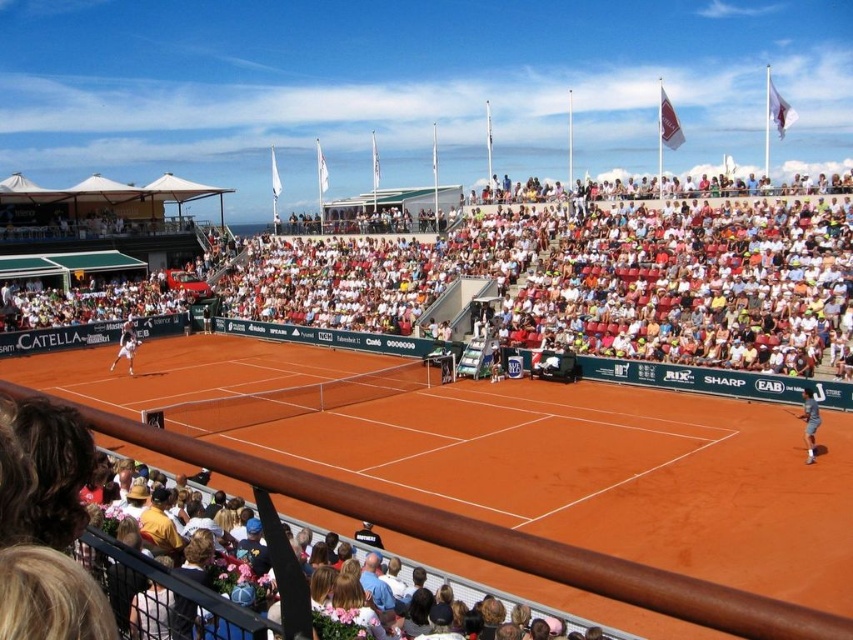
You are a tennis ball that just landed on the orange clay court at center. From your current position, where is the white tennis racket at left located relative to you?

The white tennis racket at left is located below the orange clay court at center.

You are a photographer standing at the edge of the clay court. You want to take a photo that includes both the white fabric seats at upper center and the white tennis racket at left. Which object should you focus on first to ensure both are in frame?

You should focus on the white fabric seats at upper center first because it is closer to the viewer than the white tennis racket at left, so adjusting the camera to include both would require starting with the closer object.